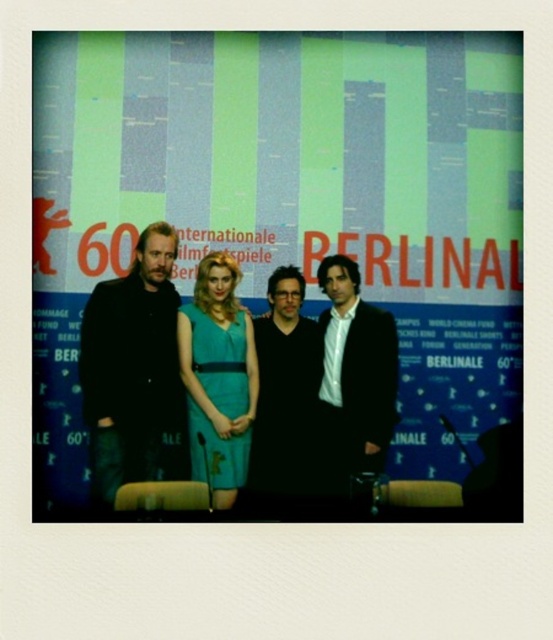
This screenshot has width=553, height=640. What do you see at coordinates (133, 371) in the screenshot?
I see `matte black suit at left` at bounding box center [133, 371].

Which is behind, point (96, 432) or point (247, 429)?

The point (247, 429) is more distant.

Find the location of a particular element. Image resolution: width=553 pixels, height=640 pixels. matte black suit at left is located at coordinates (133, 371).

Measure the distance between matte black suit at left and camera.

The distance of matte black suit at left from camera is 9.43 meters.

Is matte black suit at left bigger than black matte vest at center?

Yes.

The image size is (553, 640). I want to click on matte black suit at left, so click(x=133, y=371).

Where is `matte black suit at left`? The image size is (553, 640). matte black suit at left is located at coordinates [x=133, y=371].

Based on the photo, can you confirm if white shirt at center is taller than black matte vest at center?

Correct, white shirt at center is much taller as black matte vest at center.

Which is behind, point (372, 456) or point (260, 365)?

The point (260, 365) is behind.

Identify the location of white shirt at center. (354, 385).